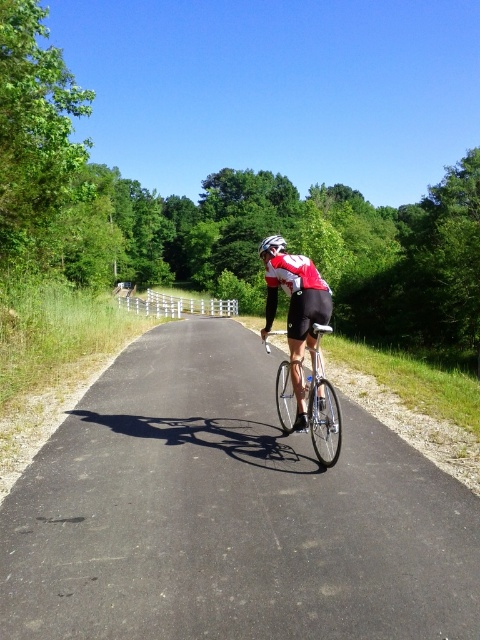
Based on the photo, you are a photographer standing at the starting point of the path. You want to take a photo of both point (313, 436) and point (268, 237) in the image. Since you can only focus on one point clearly, which point should you focus on to ensure both points are in focus?

You should focus on point (268, 237) because it is farther from the camera than point (313, 436). By focusing on the farther point, the depth of field will include the closer point as well, ensuring both are in focus.

You are a photographer standing on the path. You want to take a photo of the shiny silver bicycle at center and the silver metallic bicycle at center. Which one appears higher in the photo?

The shiny silver bicycle at center appears higher in the photo because it is positioned above the silver metallic bicycle at center.